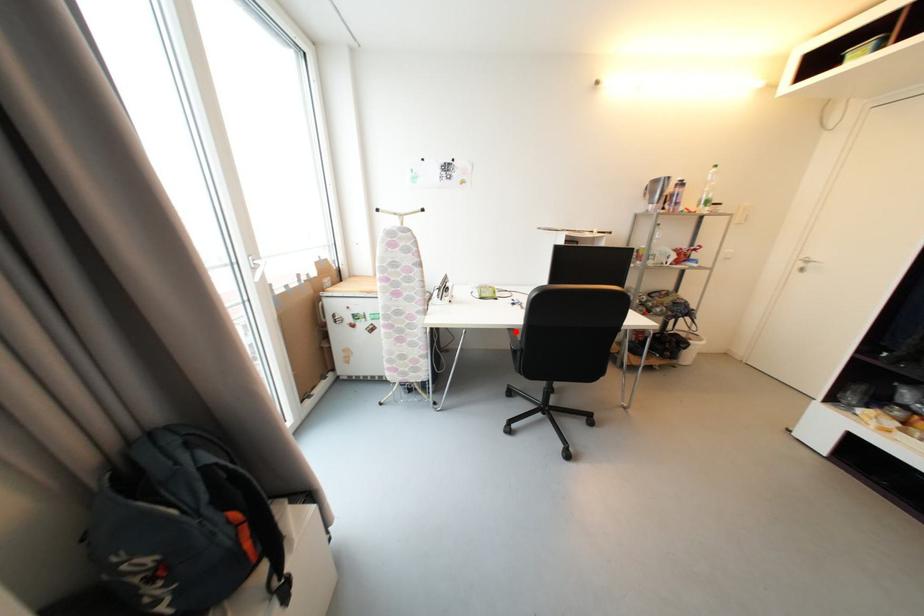
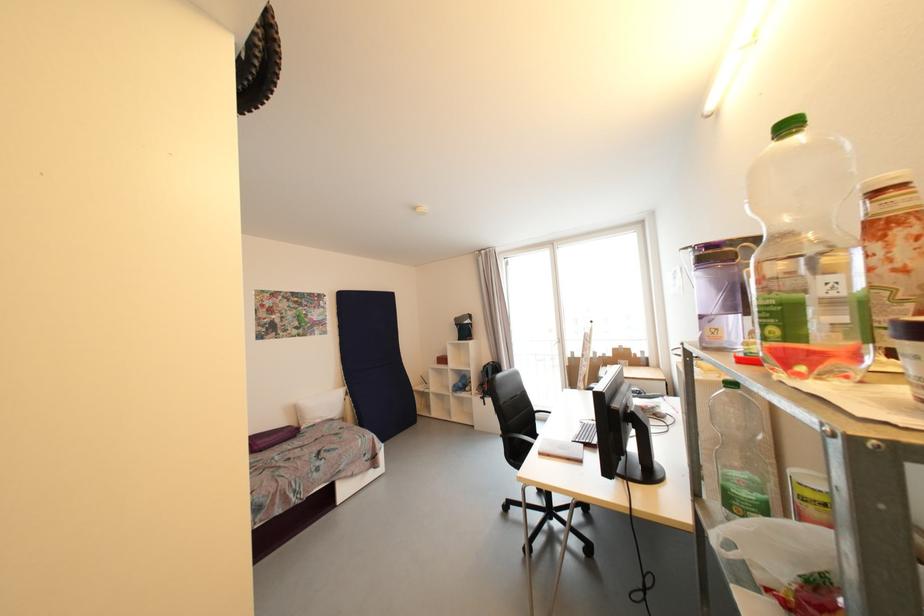
The point at the highlighted location is marked in the first image. Where is the corresponding point in the second image?

(554, 411)